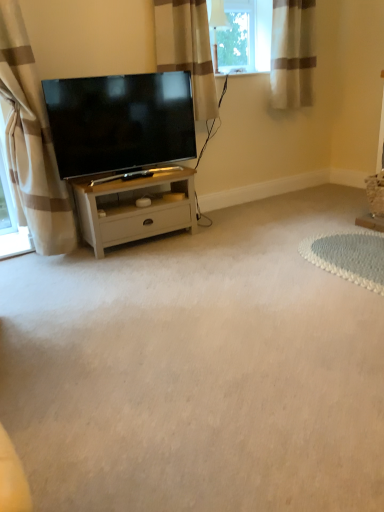
Question: Can you confirm if beige striped curtain at upper right, which is counted as the 3th curtain, starting from the left, is wider than beige striped curtain at left, the 1th curtain in the left-to-right sequence?

Choices:
 (A) no
 (B) yes

Answer: (A)

Question: Considering the relative sizes of beige striped curtain at upper right, which is counted as the 3th curtain, starting from the left, and beige striped curtain at left, the 1th curtain in the left-to-right sequence, in the image provided, is beige striped curtain at upper right, which is counted as the 3th curtain, starting from the left, shorter than beige striped curtain at left, the 1th curtain in the left-to-right sequence,?

Choices:
 (A) yes
 (B) no

Answer: (A)

Question: Can you confirm if beige striped curtain at upper right, which is counted as the 3th curtain, starting from the left, is taller than beige striped curtain at left, the third curtain when ordered from right to left?

Choices:
 (A) no
 (B) yes

Answer: (A)

Question: From a real-world perspective, is beige striped curtain at upper right, which is the 1th curtain in right-to-left order, below beige striped curtain at left, the 1th curtain in the left-to-right sequence?

Choices:
 (A) yes
 (B) no

Answer: (B)

Question: Is beige striped curtain at upper right, which is counted as the 3th curtain, starting from the left, bigger than beige striped curtain at left, the 1th curtain in the left-to-right sequence?

Choices:
 (A) no
 (B) yes

Answer: (A)

Question: Is white wood cabinet at center inside or outside of beige striped curtain at upper right, which is counted as the 3th curtain, starting from the left?

Choices:
 (A) outside
 (B) inside

Answer: (A)

Question: Would you say white wood cabinet at center is to the left or to the right of beige striped curtain at upper right, which is the 1th curtain in right-to-left order, in the picture?

Choices:
 (A) right
 (B) left

Answer: (B)

Question: From a real-world perspective, is white wood cabinet at center above or below beige striped curtain at upper right, which is the 1th curtain in right-to-left order?

Choices:
 (A) above
 (B) below

Answer: (B)

Question: Relative to beige striped curtain at upper right, which is counted as the 3th curtain, starting from the left, is white wood cabinet at center in front or behind?

Choices:
 (A) front
 (B) behind

Answer: (A)

Question: Would you say beige striped curtain at upper right, which is the 1th curtain in right-to-left order, is inside or outside matte black tv at center?

Choices:
 (A) outside
 (B) inside

Answer: (A)

Question: Looking at their shapes, would you say beige striped curtain at upper right, which is counted as the 3th curtain, starting from the left, is wider or thinner than matte black tv at center?

Choices:
 (A) wide
 (B) thin

Answer: (A)

Question: Considering the positions of beige striped curtain at upper right, which is counted as the 3th curtain, starting from the left, and matte black tv at center in the image, is beige striped curtain at upper right, which is counted as the 3th curtain, starting from the left, bigger or smaller than matte black tv at center?

Choices:
 (A) small
 (B) big

Answer: (A)

Question: Would you say beige striped curtain at upper right, which is counted as the 3th curtain, starting from the left, is to the left or to the right of matte black tv at center in the picture?

Choices:
 (A) left
 (B) right

Answer: (B)

Question: From the image's perspective, is beige fabric curtain at upper center, the second curtain when ordered from left to right, located above or below white wood cabinet at center?

Choices:
 (A) above
 (B) below

Answer: (A)

Question: Is beige fabric curtain at upper center, the second curtain when ordered from right to left, to the left or to the right of white wood cabinet at center in the image?

Choices:
 (A) left
 (B) right

Answer: (B)